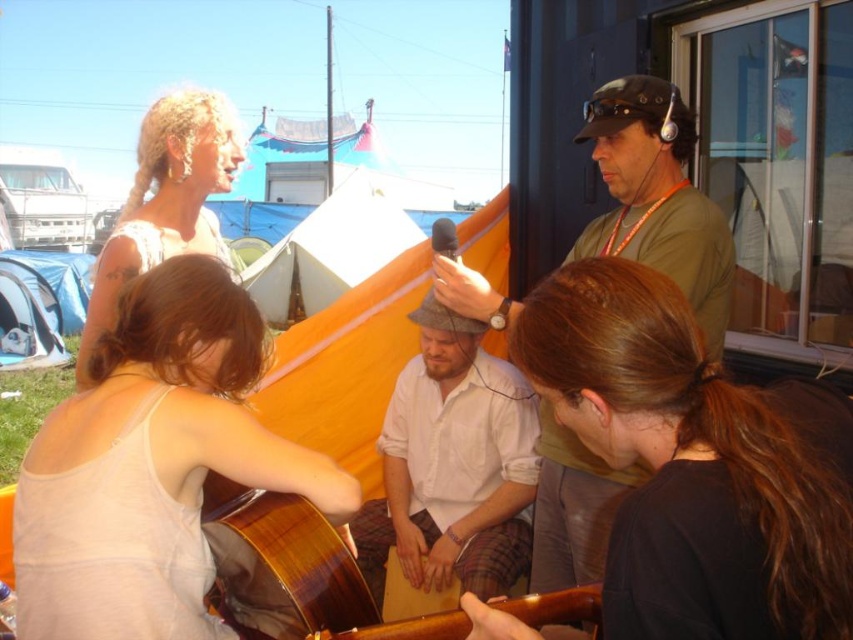
Question: Is green matte shirt at upper right positioned before blonde hair at upper left?

Choices:
 (A) no
 (B) yes

Answer: (A)

Question: Considering the real-world distances, which object is farthest from the wooden guitar at center?

Choices:
 (A) brown hair at center
 (B) green matte shirt at upper right
 (C) white cotton shirt at center
 (D) blonde hair at upper left

Answer: (C)

Question: Can you confirm if brown hair at center is positioned to the left of blonde hair at upper left?

Choices:
 (A) no
 (B) yes

Answer: (A)

Question: Considering the real-world distances, which object is farthest from the brown hair at center?

Choices:
 (A) light beige fabric guitar at lower left
 (B) wooden guitar at center
 (C) black plastic earphone at upper center

Answer: (C)

Question: Does light beige fabric guitar at lower left appear on the right side of green matte shirt at upper right?

Choices:
 (A) no
 (B) yes

Answer: (A)

Question: Which point appears closest to the camera in this image?

Choices:
 (A) (194, 534)
 (B) (466, 627)
 (C) (509, 394)
 (D) (769, 630)

Answer: (D)